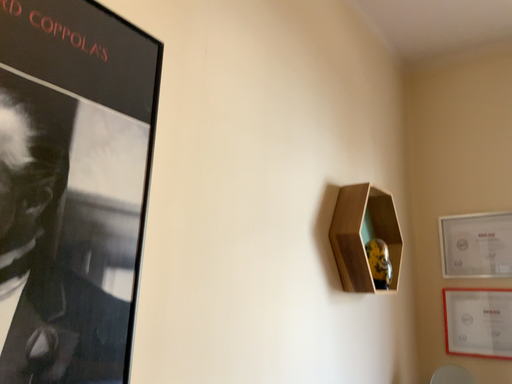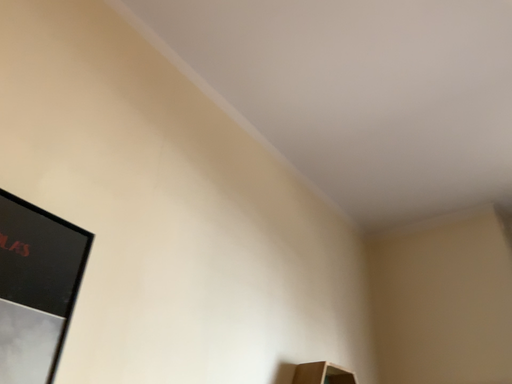
Question: Which way did the camera rotate in the video?

Choices:
 (A) rotated upward
 (B) rotated downward

Answer: (A)